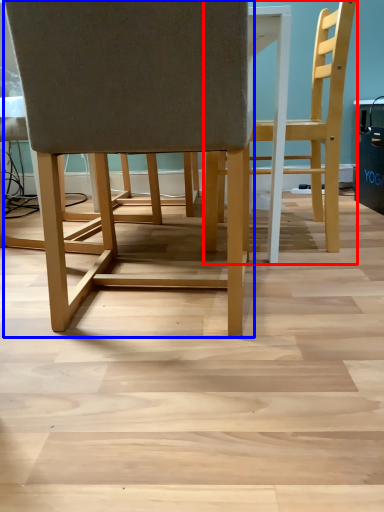
Question: Which object appears farthest to the camera in this image, chair (highlighted by a red box) or chair (highlighted by a blue box)?

Choices:
 (A) chair
 (B) chair

Answer: (A)